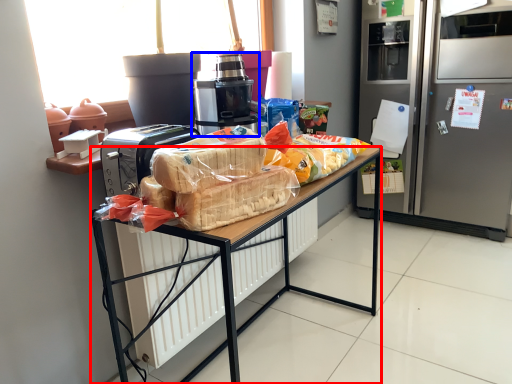
Question: Which object is closer to the camera taking this photo, desk (highlighted by a red box) or home appliance (highlighted by a blue box)?

Choices:
 (A) desk
 (B) home appliance

Answer: (A)